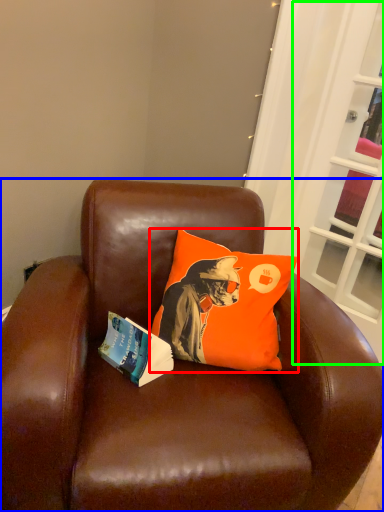
Question: Which object is the farthest from pillow (highlighted by a red box)? Choose among these: chair (highlighted by a blue box) or screen door (highlighted by a green box).

Choices:
 (A) chair
 (B) screen door

Answer: (B)